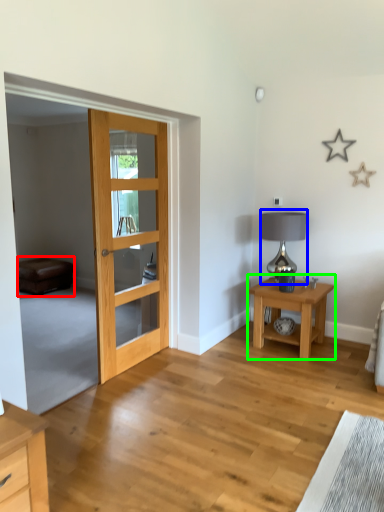
Question: Considering the real-world distances, which object is farthest from couch (highlighted by a red box)? table lamp (highlighted by a blue box) or nightstand (highlighted by a green box)?

Choices:
 (A) table lamp
 (B) nightstand

Answer: (B)